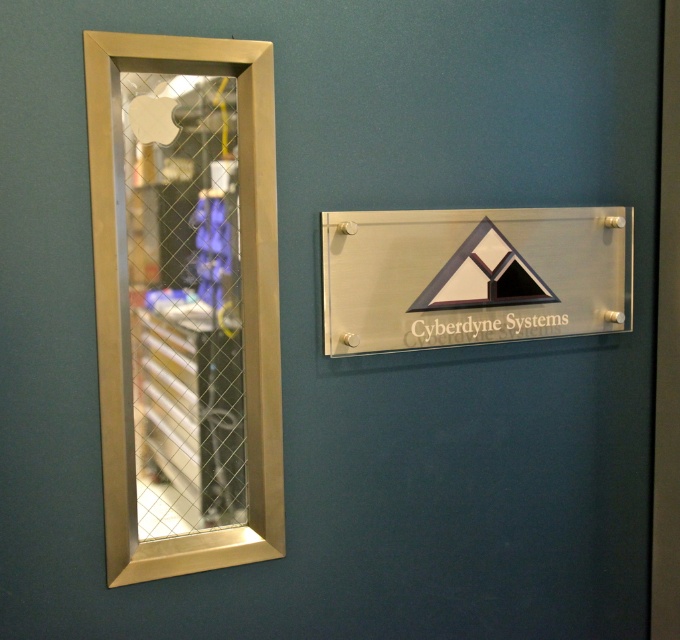
Which is below, brushed metal elevator at left or clear acrylic sign at center?

brushed metal elevator at left is below.

Measure the distance between point (173, 58) and camera.

Point (173, 58) is 5.03 feet away from camera.

Image resolution: width=680 pixels, height=640 pixels. I want to click on brushed metal elevator at left, so click(x=184, y=298).